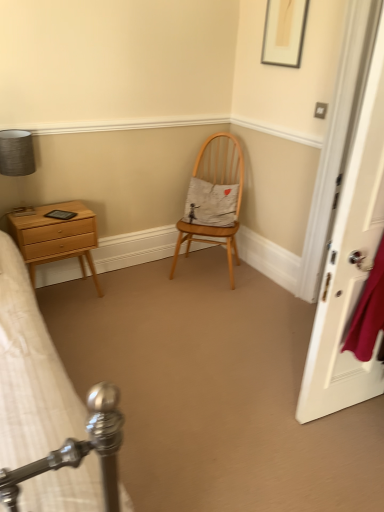
Question: Can you confirm if white wooden door at right is shorter than matte gray lampshade at upper left?

Choices:
 (A) yes
 (B) no

Answer: (B)

Question: Can you see white wooden door at right touching matte gray lampshade at upper left?

Choices:
 (A) yes
 (B) no

Answer: (B)

Question: From a real-world perspective, does white wooden door at right stand above matte gray lampshade at upper left?

Choices:
 (A) no
 (B) yes

Answer: (B)

Question: Considering the relative sizes of white wooden door at right and matte gray lampshade at upper left in the image provided, is white wooden door at right wider than matte gray lampshade at upper left?

Choices:
 (A) no
 (B) yes

Answer: (A)

Question: Considering the relative positions of white wooden door at right and matte gray lampshade at upper left in the image provided, is white wooden door at right to the right of matte gray lampshade at upper left from the viewer's perspective?

Choices:
 (A) yes
 (B) no

Answer: (A)

Question: From a real-world perspective, does white wooden door at right sit lower than matte gray lampshade at upper left?

Choices:
 (A) no
 (B) yes

Answer: (A)

Question: From the image's perspective, would you say white wooden door at right is positioned over light brown wood nightstand at left?

Choices:
 (A) yes
 (B) no

Answer: (A)

Question: Is white wooden door at right positioned with its back to light brown wood nightstand at left?

Choices:
 (A) yes
 (B) no

Answer: (B)

Question: Does white wooden door at right have a smaller size compared to light brown wood nightstand at left?

Choices:
 (A) yes
 (B) no

Answer: (B)

Question: From a real-world perspective, is white wooden door at right positioned over light brown wood nightstand at left based on gravity?

Choices:
 (A) no
 (B) yes

Answer: (B)

Question: Does white wooden door at right appear on the left side of light brown wood nightstand at left?

Choices:
 (A) yes
 (B) no

Answer: (B)

Question: Is white wooden door at right positioned beyond the bounds of light brown wood nightstand at left?

Choices:
 (A) no
 (B) yes

Answer: (B)

Question: Can you confirm if light wood chair at center is taller than matte gray lampshade at upper left?

Choices:
 (A) yes
 (B) no

Answer: (A)